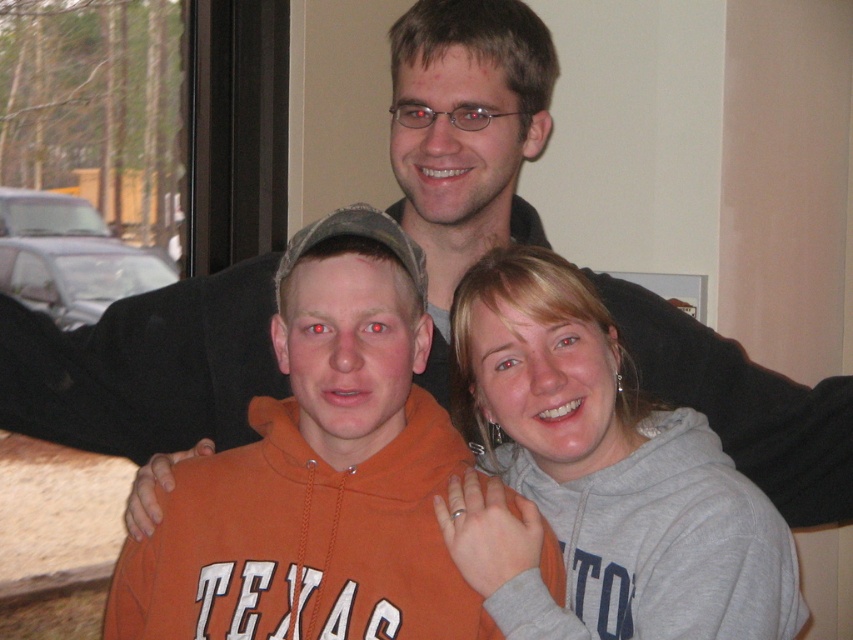
Question: Is orange fleece sweatshirt at center behind gray fleece sweatshirt at lower right?

Choices:
 (A) no
 (B) yes

Answer: (A)

Question: Does orange fleece sweatshirt at center have a larger size compared to gray fleece sweatshirt at lower right?

Choices:
 (A) yes
 (B) no

Answer: (B)

Question: Is orange fleece sweatshirt at center closer to the viewer compared to gray fleece sweatshirt at lower right?

Choices:
 (A) no
 (B) yes

Answer: (B)